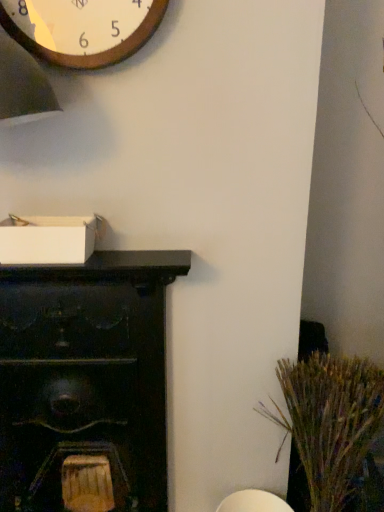
Question: In terms of width, does dry grass at right look wider or thinner when compared to wooden wall clock at upper left?

Choices:
 (A) wide
 (B) thin

Answer: (A)

Question: From the image's perspective, is dry grass at right above or below wooden wall clock at upper left?

Choices:
 (A) above
 (B) below

Answer: (B)

Question: Considering the real-world distances, which object is farthest from the dark wood cabinet at left?

Choices:
 (A) dry grass at right
 (B) wooden wall clock at upper left

Answer: (B)

Question: Based on their relative distances, which object is farther from the dry grass at right?

Choices:
 (A) dark wood cabinet at left
 (B) wooden wall clock at upper left

Answer: (B)